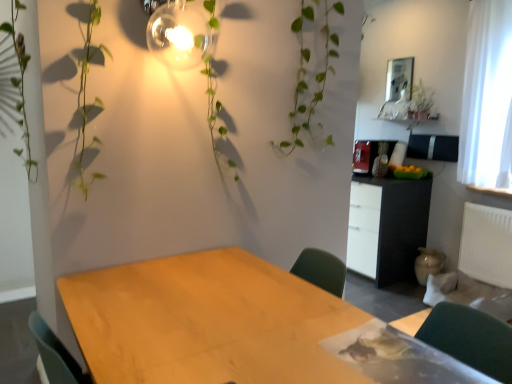
Question: From a real-world perspective, is matte glass light fixture at upper center positioned above or below black matte cabinet at center right?

Choices:
 (A) above
 (B) below

Answer: (A)

Question: From the image's perspective, is matte glass light fixture at upper center above or below black matte cabinet at center right?

Choices:
 (A) below
 (B) above

Answer: (B)

Question: Considering the real-world distances, which object is farthest from the metallic silver picture frame at upper right?

Choices:
 (A) matte glass light fixture at upper center
 (B) wooden table at center
 (C) white plastic radiator at right
 (D) white sheer curtain at right
 (E) black matte cabinet at center right

Answer: (B)

Question: Estimate the real-world distances between objects in this image. Which object is farther from the white plastic radiator at right?

Choices:
 (A) black matte cabinet at center right
 (B) wooden table at center
 (C) white sheer curtain at right
 (D) matte glass light fixture at upper center
 (E) metallic silver picture frame at upper right

Answer: (D)